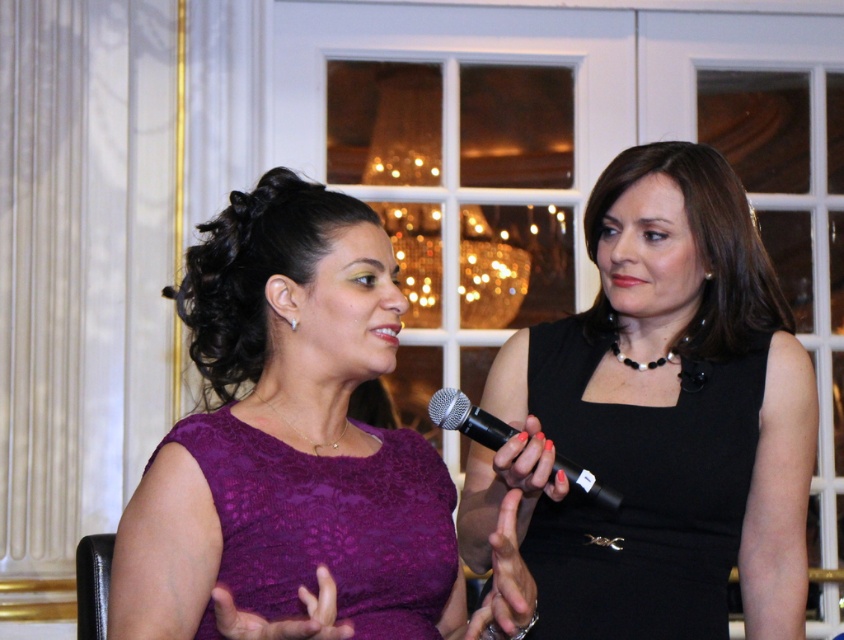
You are a photographer at a formal event and need to ensure both women are clearly visible in the photo. The purple lace dress at center and the lace purple dress at center are both important subjects. Based on their sizes, which dress should you focus on to ensure it stands out more in the photo?

The purple lace dress at center is larger in size than the lace purple dress at center, so focusing on the purple lace dress at center will make it stand out more in the photo.